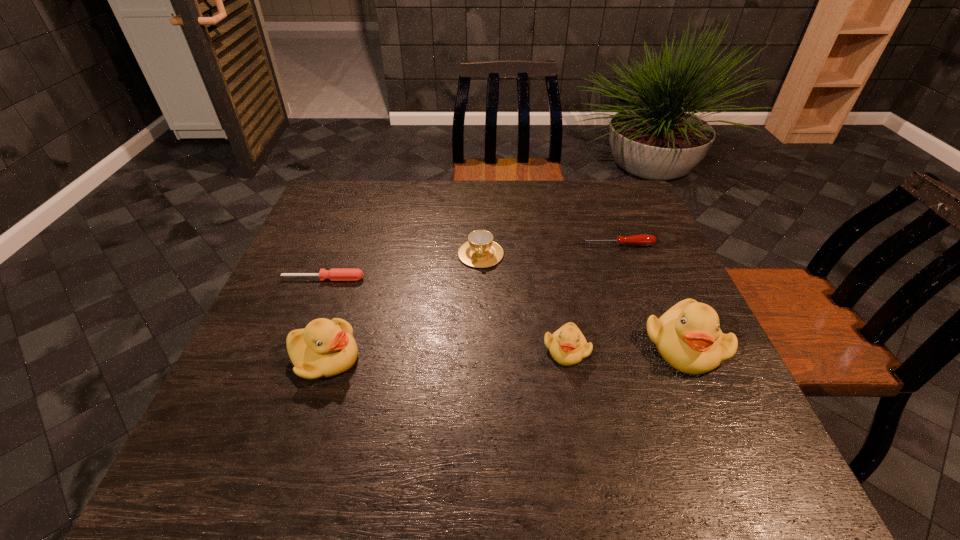
To ensure equal spacing by inserting another duckling among them, please point out a vacant spot for this new duckling. Please provide its 2D coordinates. Your answer should be formatted as a tuple, i.e. [(x, y)], where the tuple contains the x and y coordinates of a point satisfying the conditions above.

[(446, 354)]